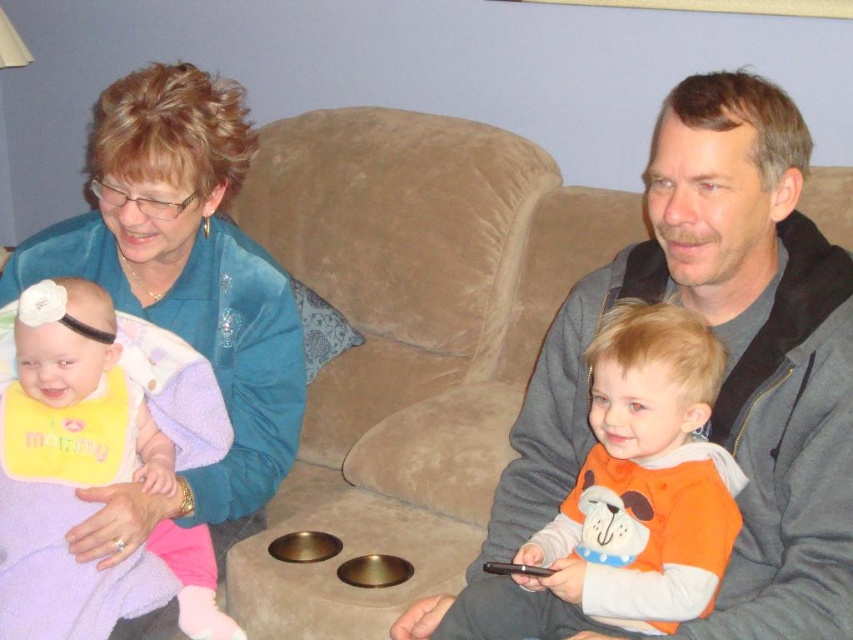
You are a photographer taking a picture of the yellow bib at left and the orange soft fabric baby at center. Which object is located more to the left in the image?

The yellow bib at left is positioned on the left side of orange soft fabric baby at center, so the yellow bib at left is more to the left.

What is the object located at the coordinates point [727,356]?

The object located at point [727,356] is the gray fleece jacket at center.